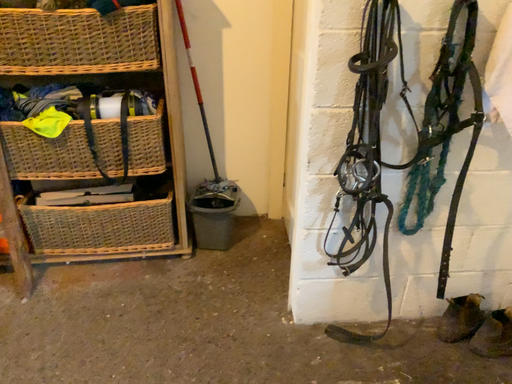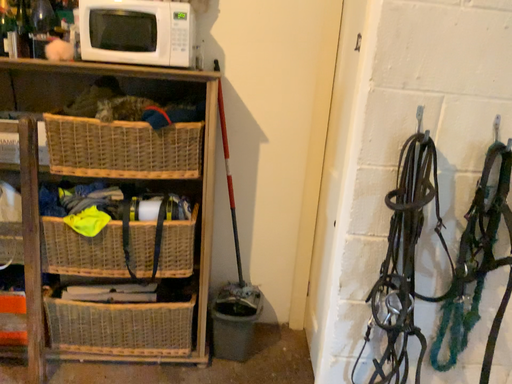
Question: Which way did the camera rotate in the video?

Choices:
 (A) rotated upward
 (B) rotated downward

Answer: (A)